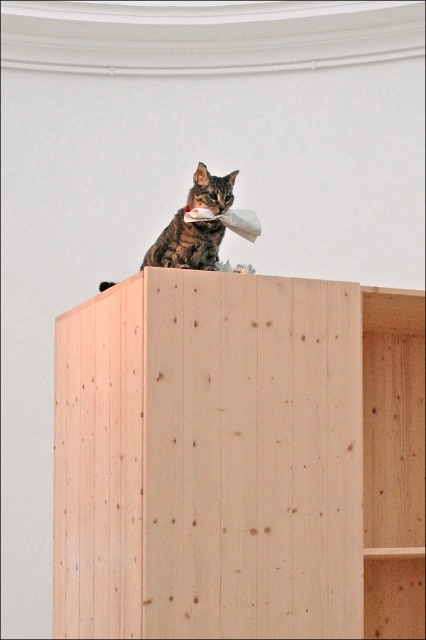
Which of these two, natural wood bookshelf at upper center or tabby fur cat at upper center, stands taller?

natural wood bookshelf at upper center

Does point (181, 381) come closer to viewer compared to point (198, 268)?

That is True.

Describe the element at coordinates (238, 460) in the screenshot. I see `natural wood bookshelf at upper center` at that location.

This screenshot has width=426, height=640. I want to click on natural wood bookshelf at upper center, so click(238, 460).